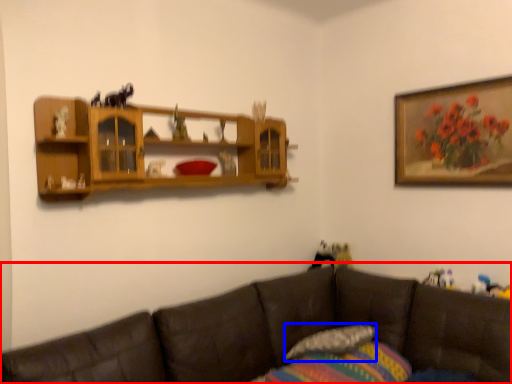
Question: Among these objects, which one is farthest to the camera, studio couch (highlighted by a red box) or pillow (highlighted by a blue box)?

Choices:
 (A) studio couch
 (B) pillow

Answer: (B)